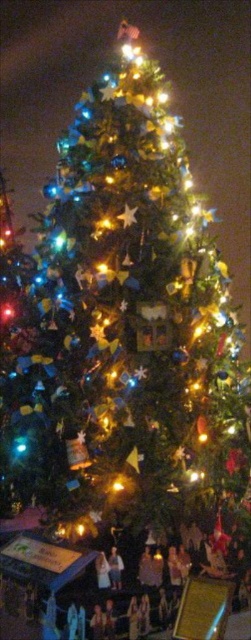
From the picture: You are standing at the origin point of the image coordinate system, which is at the bottom left corner. You want to find the white cotton shirt at lower center. In which direction should you look relative to your current position?

The white cotton shirt at lower center is located at point 0.889 on the x axis and 0.458 on the y axis. Since the origin is at the bottom left corner, you should look to the right and slightly upwards to find the white cotton shirt at lower center.

You are standing in front of the Christmas tree and notice the white cotton shirt at lower center and the metallic gold star at center. Which object is nearer to you?

The white cotton shirt at lower center is closer to the viewer than the metallic gold star at center.